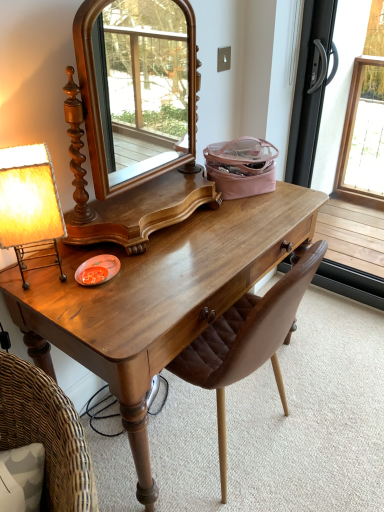
Where is `vacant area on top of brown leather chair at center (from a real-world perspective)`? Image resolution: width=384 pixels, height=512 pixels. vacant area on top of brown leather chair at center (from a real-world perspective) is located at coordinates 309,408.